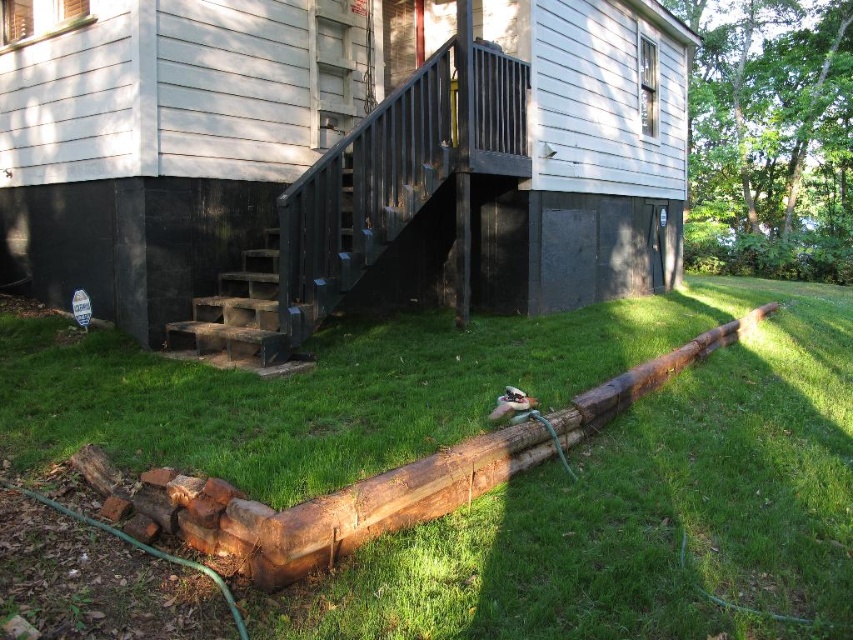
You are standing at the point marked by the coordinates point (519, 477). Looking around, you see the residential house with white siding and dark trim. What is directly beneath your feet?

The point (519, 477) corresponds to green grass at lower left, so the green grass at lower left is directly beneath your feet.

In the scene shown: You are a gardener who needs to move a heavy tool from the house to the green grass at lower left. The dark gray concrete stairs at lower left are in the way. Can you move the tool around the stairs to reach the grass?

The green grass at lower left is bigger than dark gray concrete stairs at lower left, so yes, you can move the tool around the stairs since the grass area is larger than the stairs.

Consider the image. You are standing on the porch of the house and want to walk down to the green grass at lower left and the dark gray concrete stairs at lower left. Which one will you step onto first?

You will step onto the green grass at lower left first because it is closer to the viewer than the dark gray concrete stairs at lower left.